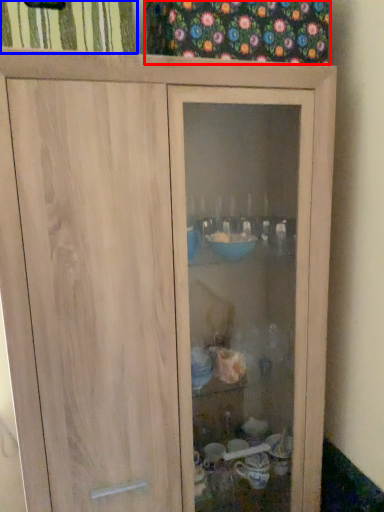
Question: Which object appears closest to the camera in this image, curtain (highlighted by a red box) or curtain (highlighted by a blue box)?

Choices:
 (A) curtain
 (B) curtain

Answer: (B)